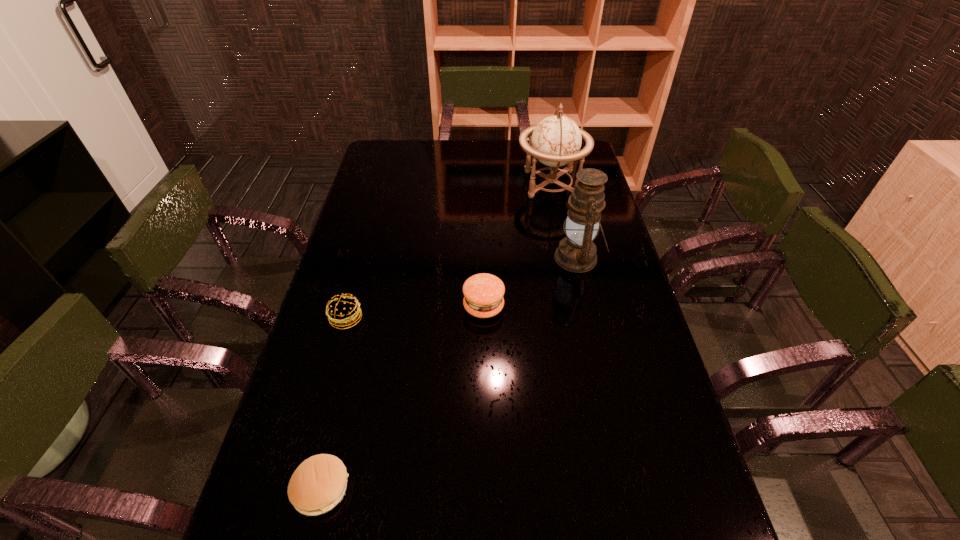
Locate an element on the screen. This screenshot has height=540, width=960. free space that is in between the fourth tallest object and the second farthest object is located at coordinates (462, 288).

Where is `object that is the fourth closest to the shortest patty`? This screenshot has height=540, width=960. object that is the fourth closest to the shortest patty is located at coordinates (556, 141).

This screenshot has width=960, height=540. I want to click on object identified as the third closest to the second tallest patty, so click(x=576, y=253).

What are the coordinates of `the second closest patty to the third object from left to right` in the screenshot? It's located at click(x=319, y=483).

This screenshot has width=960, height=540. I want to click on patty identified as the closest to the fourth tallest object, so click(483, 293).

I want to click on vacant space that satisfies the following two spatial constraints: 1. on the front-facing side of the farthest object; 2. on the front side of the second tallest patty, so click(578, 319).

Identify the location of vacant space that satisfies the following two spatial constraints: 1. on the front-facing side of the globe; 2. on the front side of the shortest object. The height and width of the screenshot is (540, 960). (612, 488).

Identify the location of vacant space that satisfies the following two spatial constraints: 1. on the front-facing side of the oil lamp; 2. on the left side of the globe. Image resolution: width=960 pixels, height=540 pixels. (565, 258).